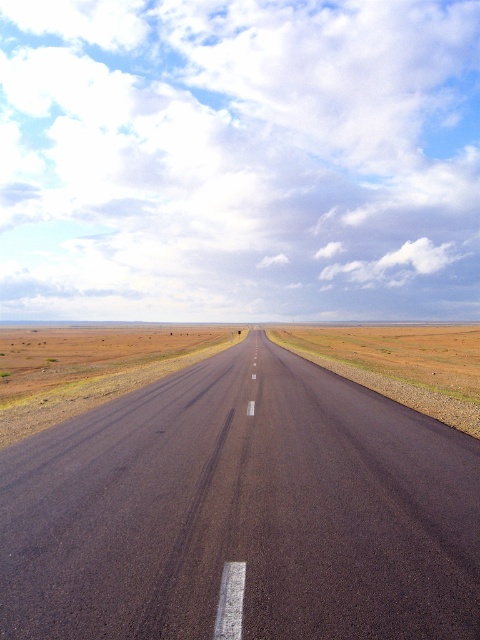
Is black asphalt highway at center to the right of brown dirt at center from the viewer's perspective?

Correct, you'll find black asphalt highway at center to the right of brown dirt at center.

Is point (158, 481) positioned behind point (58, 321)?

No, (158, 481) is in front of (58, 321).

At what (x,y) coordinates should I click in order to perform the action: click on black asphalt highway at center. Please return your answer as a coordinate pair (x, y). Looking at the image, I should click on (241, 512).